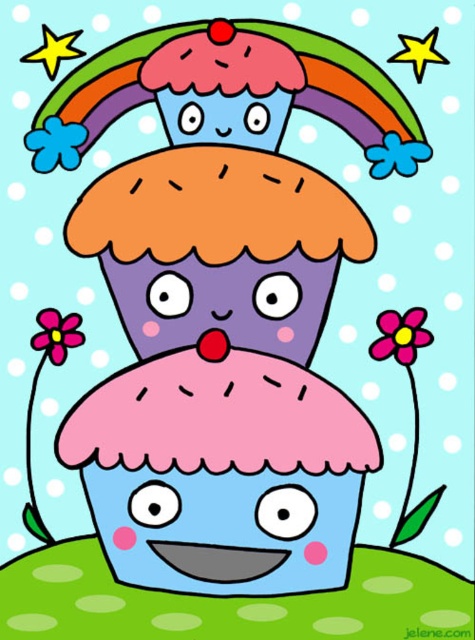
Can you confirm if pink fabric flower at upper right is positioned to the left of blue matte flower at upper left?

In fact, pink fabric flower at upper right is to the right of blue matte flower at upper left.

Does pink fabric flower at upper right appear on the right side of blue matte flower at upper left?

Indeed, pink fabric flower at upper right is positioned on the right side of blue matte flower at upper left.

Is point (423, 342) more distant than point (66, 145)?

No, (423, 342) is in front of (66, 145).

This screenshot has height=640, width=475. Find the location of `pink fabric flower at upper right`. pink fabric flower at upper right is located at coordinates 400,336.

Is purple matte cupcake face at center positioned behind pink fabric flower at upper right?

Yes, purple matte cupcake face at center is behind pink fabric flower at upper right.

Describe the element at coordinates (224, 301) in the screenshot. I see `purple matte cupcake face at center` at that location.

Describe the element at coordinates (224, 301) in the screenshot. This screenshot has height=640, width=475. I see `purple matte cupcake face at center` at that location.

Where is `purple matte cupcake face at center`? The width and height of the screenshot is (475, 640). purple matte cupcake face at center is located at coordinates (224, 301).

Is point (182, 513) behind point (408, 323)?

No, it is in front of (408, 323).

What do you see at coordinates (226, 525) in the screenshot?
I see `matte blue cupcake at center` at bounding box center [226, 525].

Between point (302, 474) and point (390, 355), which one is positioned in front?

Point (302, 474) is in front.

Identify the location of matte blue cupcake at center. (226, 525).